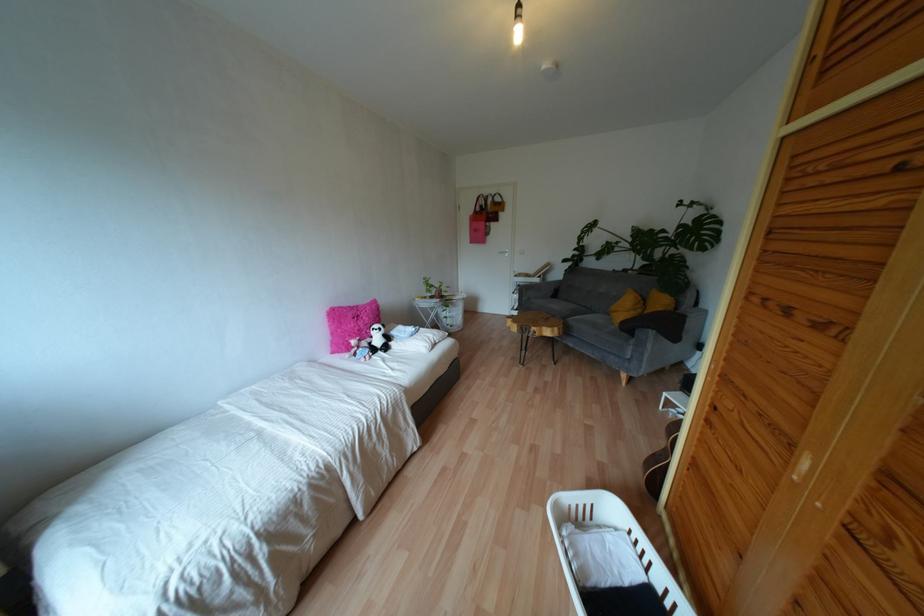
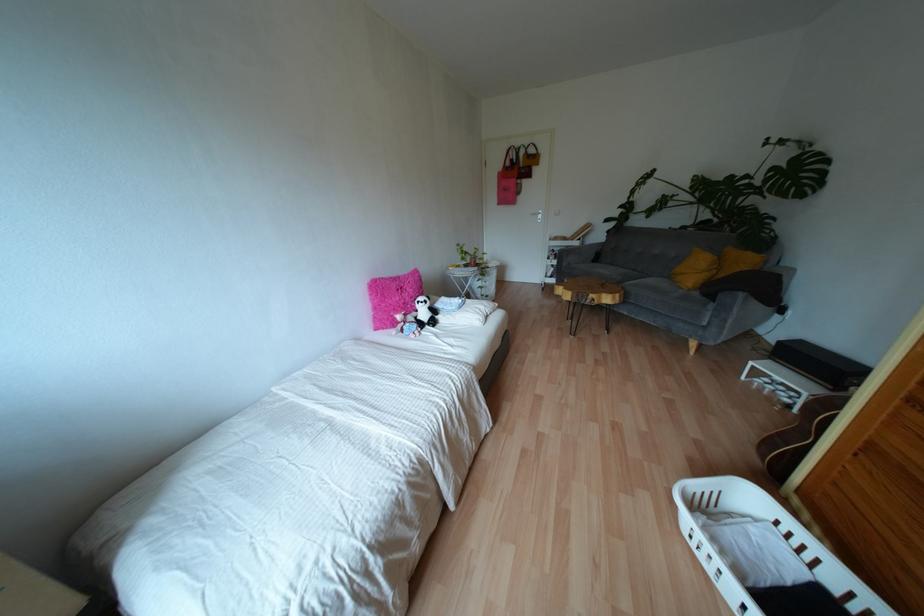
Question: How did the camera likely rotate?

Choices:
 (A) Left
 (B) Right
 (C) Up
 (D) Down

Answer: (D)